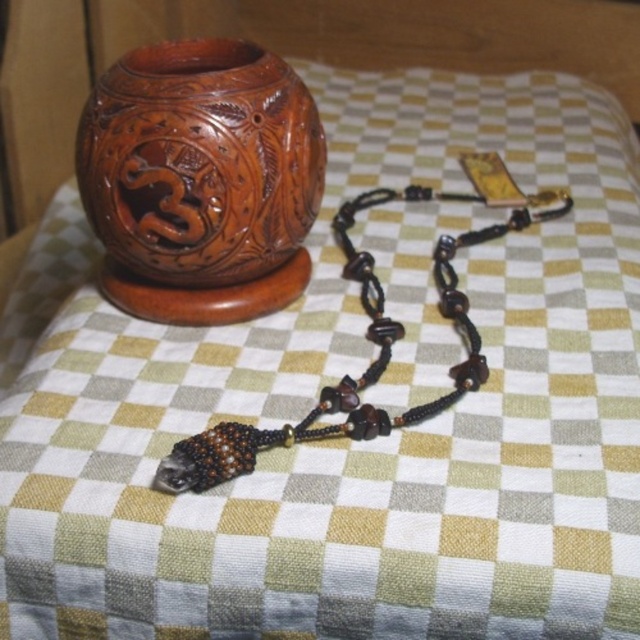
Question: Which point is farther to the camera?

Choices:
 (A) brown beaded necklace at lower left
 (B) carved wood vase at upper left

Answer: (B)

Question: Can you confirm if carved wood vase at upper left is positioned to the right of brown beaded necklace at lower left?

Choices:
 (A) yes
 (B) no

Answer: (B)

Question: Which point is farther to the camera?

Choices:
 (A) (428, 189)
 (B) (316, 179)

Answer: (A)

Question: Does carved wood vase at upper left appear on the left side of brown beaded necklace at lower left?

Choices:
 (A) no
 (B) yes

Answer: (B)

Question: Can you confirm if carved wood vase at upper left is bigger than brown beaded necklace at lower left?

Choices:
 (A) yes
 (B) no

Answer: (B)

Question: Which point is closer to the camera taking this photo?

Choices:
 (A) [516, 228]
 (B) [173, 208]

Answer: (B)